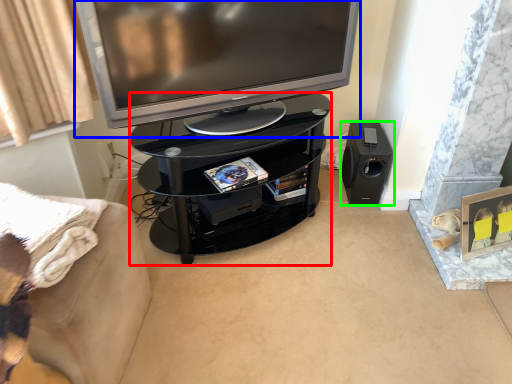
Question: Estimate the real-world distances between objects in this image. Which object is closer to tv cabinet (highlighted by a red box), television (highlighted by a blue box) or loudspeaker (highlighted by a green box)?

Choices:
 (A) television
 (B) loudspeaker

Answer: (A)